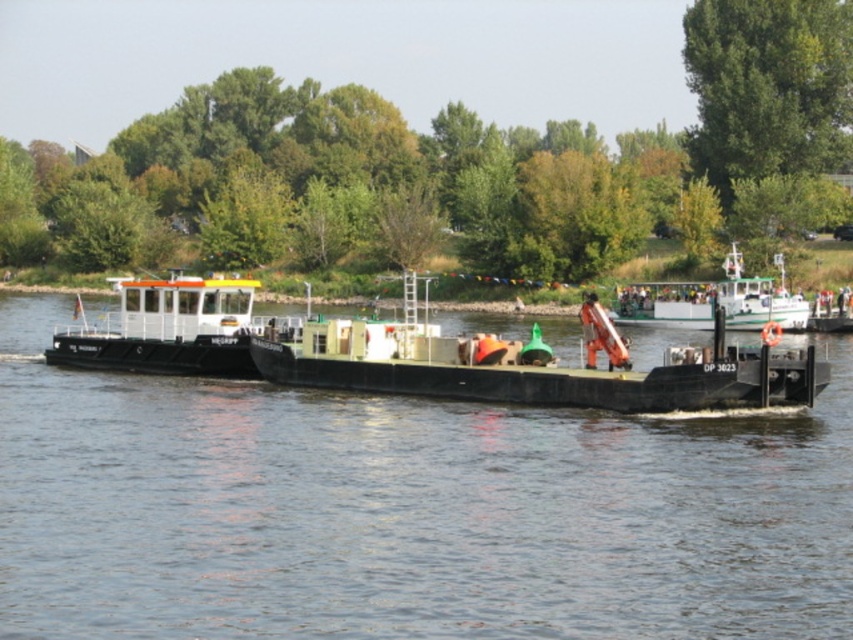
Can you confirm if green matte barge at center is positioned above white matte barge at left?

Incorrect, green matte barge at center is not positioned above white matte barge at left.

Measure the distance between point (405, 358) and camera.

They are 48.60 meters apart.

You are a GUI agent. You are given a task and a screenshot of the screen. Output one action in this format:
    pyautogui.click(x=<x>, y=<y>)
    Task: Click on the green matte barge at center
    The height and width of the screenshot is (640, 853).
    Given the screenshot: What is the action you would take?
    pyautogui.click(x=532, y=365)

Can you confirm if black rubber boat at center is bigger than green matte barge at center?

Yes, black rubber boat at center is bigger than green matte barge at center.

Does point (62, 410) come closer to viewer compared to point (389, 348)?

Yes.

Image resolution: width=853 pixels, height=640 pixels. Identify the location of black rubber boat at center. (405, 509).

Between black rubber boat at center and white matte barge at left, which one has less height?

black rubber boat at center

Is black rubber boat at center below white matte barge at left?

Yes.

What do you see at coordinates (405, 509) in the screenshot? The height and width of the screenshot is (640, 853). I see `black rubber boat at center` at bounding box center [405, 509].

Locate an element on the screen. black rubber boat at center is located at coordinates (405, 509).